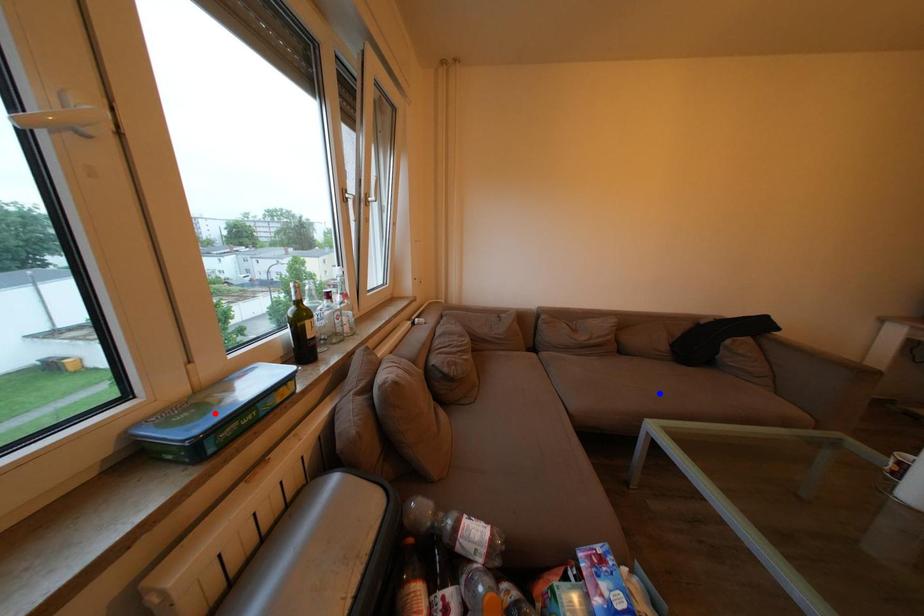
Question: In the image, two points are highlighted. Which point is nearer to the camera? Reply with the corresponding letter.

Choices:
 (A) blue point
 (B) red point

Answer: (B)